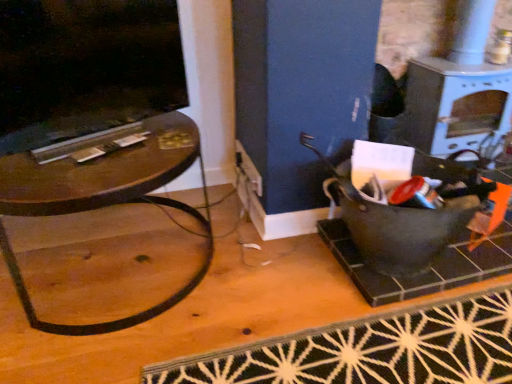
Question: From the image's perspective, would you say white glossy stove at upper right is positioned over black glossy fireplace at upper left?

Choices:
 (A) yes
 (B) no

Answer: (A)

Question: Does white glossy stove at upper right have a larger size compared to black glossy fireplace at upper left?

Choices:
 (A) yes
 (B) no

Answer: (A)

Question: Is white glossy stove at upper right beside black glossy fireplace at upper left?

Choices:
 (A) no
 (B) yes

Answer: (A)

Question: Is white glossy stove at upper right not inside black glossy fireplace at upper left?

Choices:
 (A) no
 (B) yes

Answer: (B)

Question: Is white glossy stove at upper right smaller than black glossy fireplace at upper left?

Choices:
 (A) yes
 (B) no

Answer: (B)

Question: Is white glossy stove at upper right taller than black glossy fireplace at upper left?

Choices:
 (A) no
 (B) yes

Answer: (B)

Question: From the image's perspective, would you say white glossy stove at upper right is positioned over black woven mat at lower center?

Choices:
 (A) yes
 (B) no

Answer: (A)

Question: Can you confirm if white glossy stove at upper right is shorter than black woven mat at lower center?

Choices:
 (A) yes
 (B) no

Answer: (B)

Question: Is white glossy stove at upper right positioned beyond the bounds of black woven mat at lower center?

Choices:
 (A) no
 (B) yes

Answer: (B)

Question: Is white glossy stove at upper right far from black woven mat at lower center?

Choices:
 (A) no
 (B) yes

Answer: (A)

Question: Does white glossy stove at upper right have a greater height compared to black woven mat at lower center?

Choices:
 (A) no
 (B) yes

Answer: (B)

Question: Does white glossy stove at upper right come in front of black woven mat at lower center?

Choices:
 (A) no
 (B) yes

Answer: (A)

Question: Is black woven mat at lower center closer to the viewer compared to white glossy stove at upper right?

Choices:
 (A) no
 (B) yes

Answer: (B)